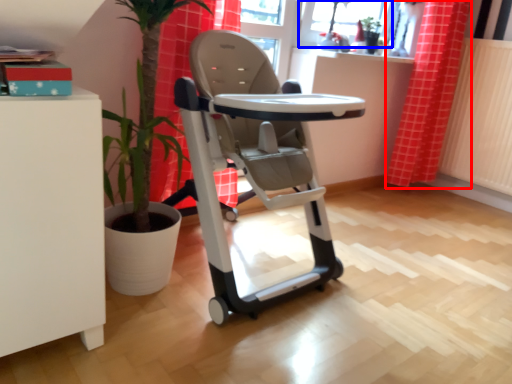
Question: Which point is closer to the camera, curtain (highlighted by a red box) or window screen (highlighted by a blue box)?

Choices:
 (A) curtain
 (B) window screen

Answer: (B)